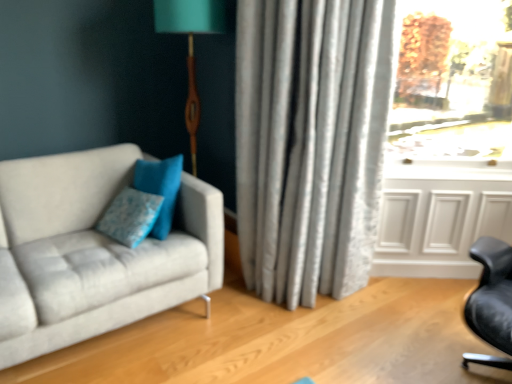
The height and width of the screenshot is (384, 512). In order to click on free location above white paneling at lower right (from a real-world perspective) in this screenshot , I will do `click(453, 177)`.